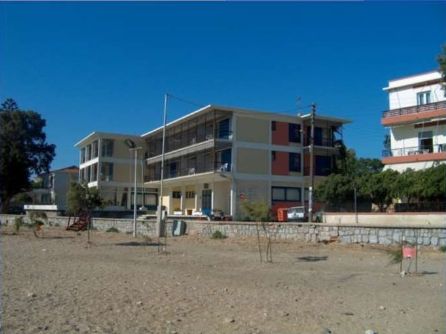
Locate an element on the screen. window is located at coordinates (294, 158).